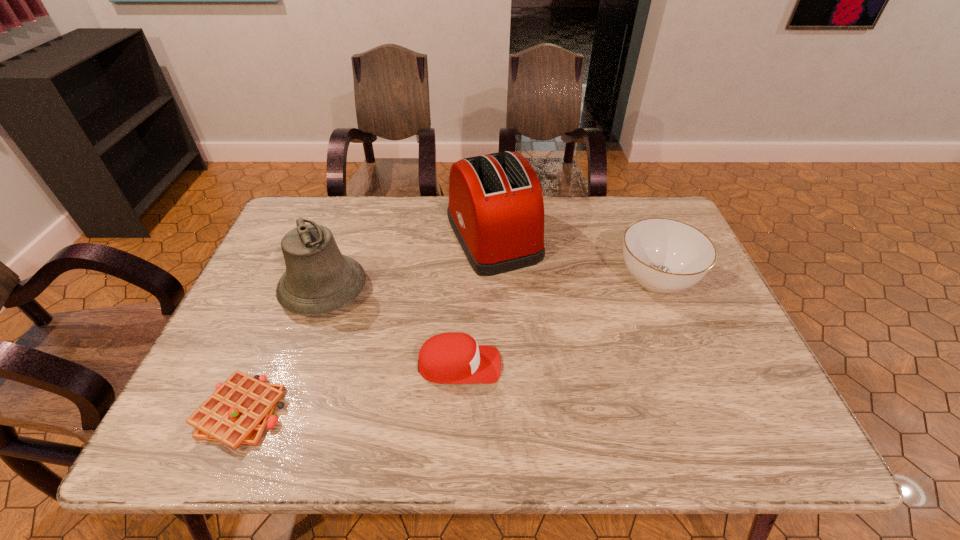
Where is `toaster`? This screenshot has height=540, width=960. toaster is located at coordinates (496, 210).

This screenshot has width=960, height=540. I want to click on the second tallest object, so [318, 279].

Identify the location of the rightmost object. (663, 255).

You are a GUI agent. You are given a task and a screenshot of the screen. Output one action in this format:
    pyautogui.click(x=<x>, y=<y>)
    Task: Click on the third shortest object
    Image resolution: width=960 pixels, height=540 pixels.
    Given the screenshot: What is the action you would take?
    pyautogui.click(x=663, y=255)

You are a GUI agent. You are given a task and a screenshot of the screen. Output one action in this format:
    pyautogui.click(x=<x>, y=<y>)
    Task: Click on the fourth tallest object
    This screenshot has height=540, width=960.
    Given the screenshot: What is the action you would take?
    pyautogui.click(x=448, y=358)

You are a GUI agent. You are given a task and a screenshot of the screen. Output one action in this format:
    pyautogui.click(x=<x>, y=<y>)
    Task: Click on the waffle
    
    Given the screenshot: What is the action you would take?
    pyautogui.click(x=238, y=412)

The width and height of the screenshot is (960, 540). I want to click on free location located on the right of the toaster, so click(618, 237).

The height and width of the screenshot is (540, 960). I want to click on vacant space located on the back of the fourth shortest object, so click(357, 197).

Find the location of a particular element. This screenshot has width=960, height=540. free spot located on the front of the third shortest object is located at coordinates coord(699,384).

Locate an element on the screen. Image resolution: width=960 pixels, height=540 pixels. vacant space located 0.300m on the front-facing side of the fourth tallest object is located at coordinates [x=636, y=365].